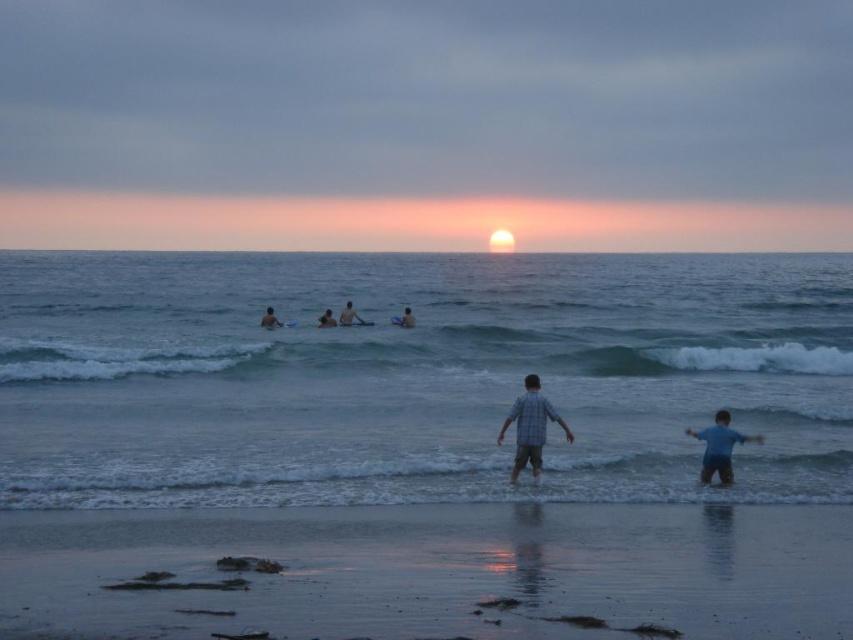
You are standing on the beach and want to place a small bucket on the smooth sand at lower center. However, you also have a larger beach towel that needs to be placed near the plaid shirt at center. Based on the scene description, can both items fit on their respective spots without overlapping?

The smooth sand at lower center has a width less than the plaid shirt at center, so the small bucket may fit on the smooth sand at lower center. However, the beach towel might not fit on the smooth sand at lower center due to its smaller width compared to the plaid shirt at center. The larger beach towel should be placed near the plaid shirt at center where there is more space.